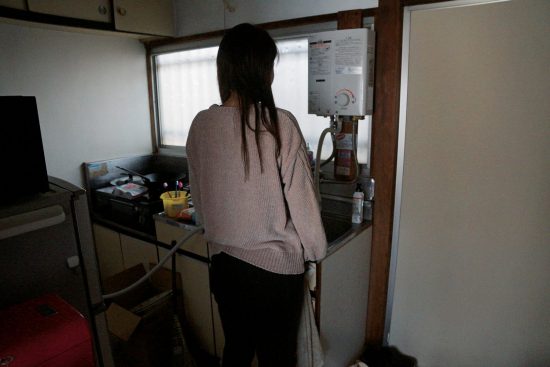
At what (x,y) coordinates should I click in order to perform the action: click on greyish white wall. Please return your answer as a coordinate pair (x, y). This screenshot has height=367, width=550. Looking at the image, I should click on tap(100, 87).